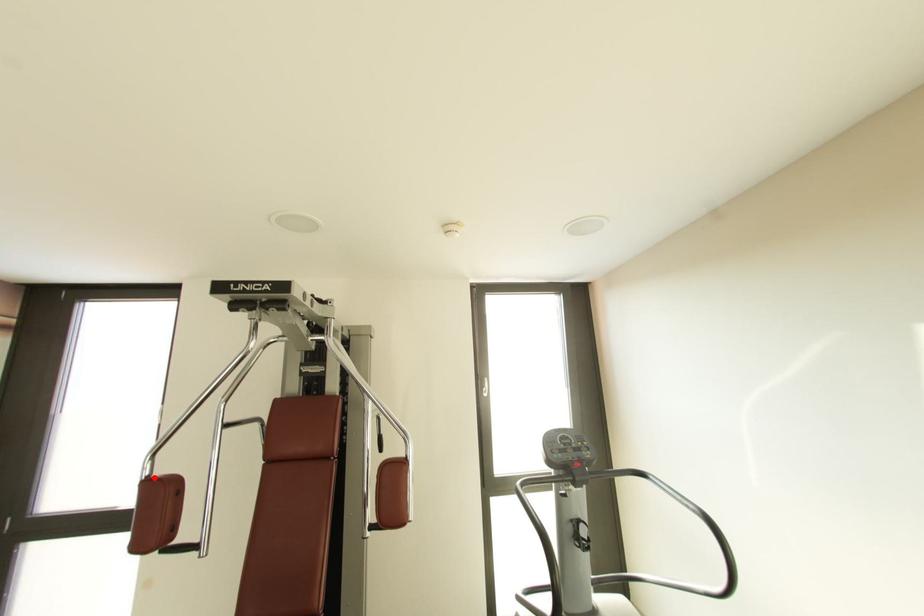
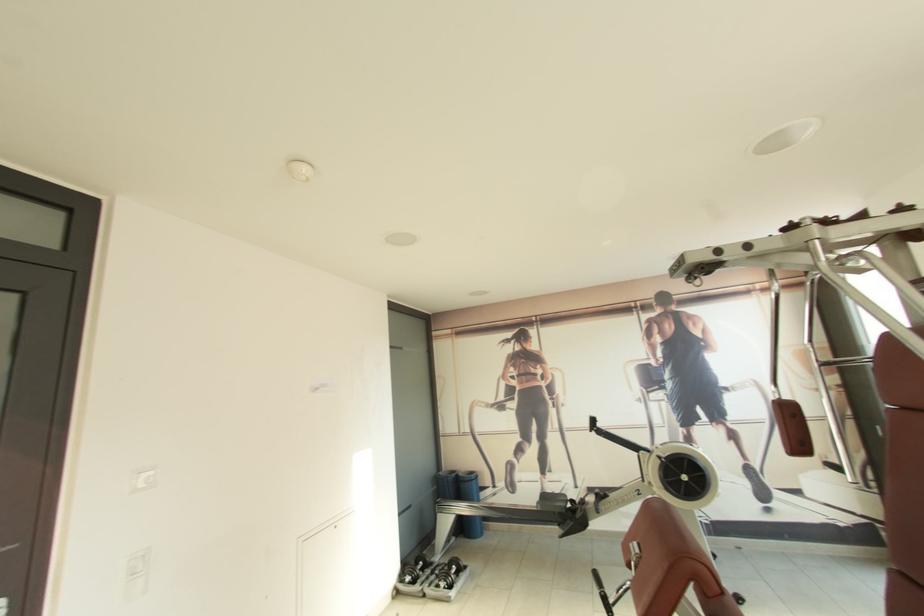
Question: I am providing you with two images of the same scene from different viewpoints. A red point is marked on the first image. Is the red point's position out of view in image 2?

Choices:
 (A) Yes
 (B) No

Answer: (B)